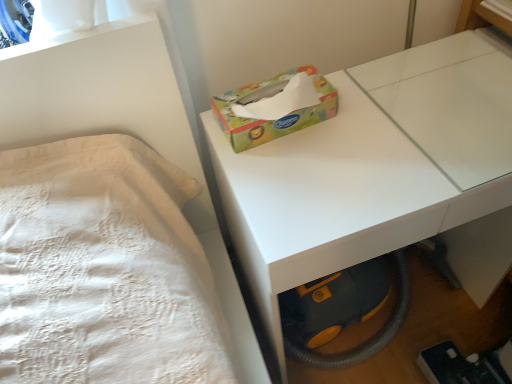
In order to click on free point to the right of multicolored cardboard tissue box at center in this screenshot , I will do `click(372, 113)`.